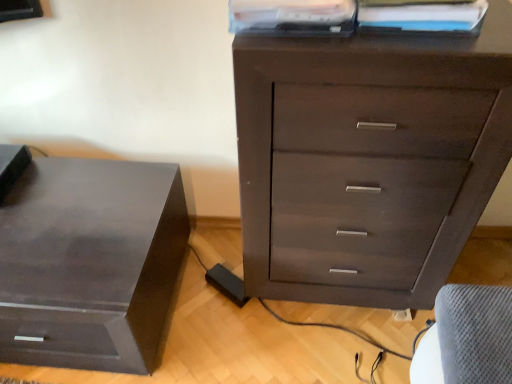
Locate an element on the screen. The image size is (512, 384). free space in front of white paper at upper center, the second book viewed from the left is located at coordinates (430, 49).